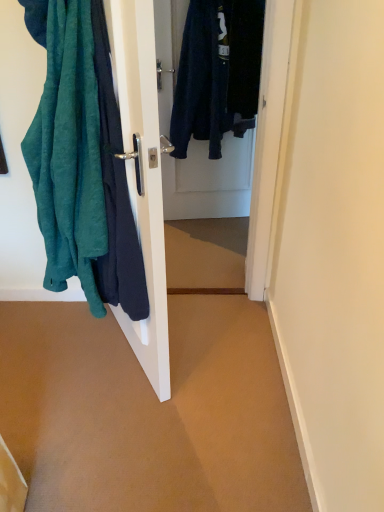
At what (x,y) coordinates should I click in order to perform the action: click on vacant area that lies to the right of teal fabric at left. Please return your answer as a coordinate pair (x, y). The image size is (384, 512). Looking at the image, I should click on (218, 353).